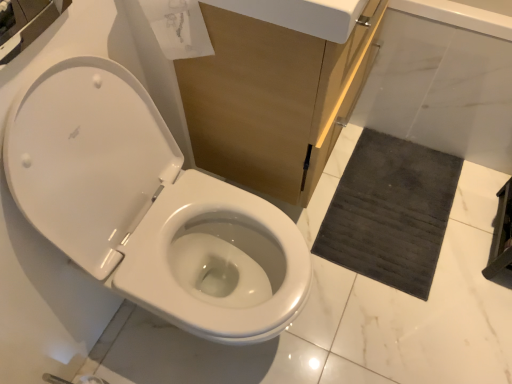
Identify the location of free space that is in between white marble bath at lower right and dark gray textured bath mat at lower right. (432, 199).